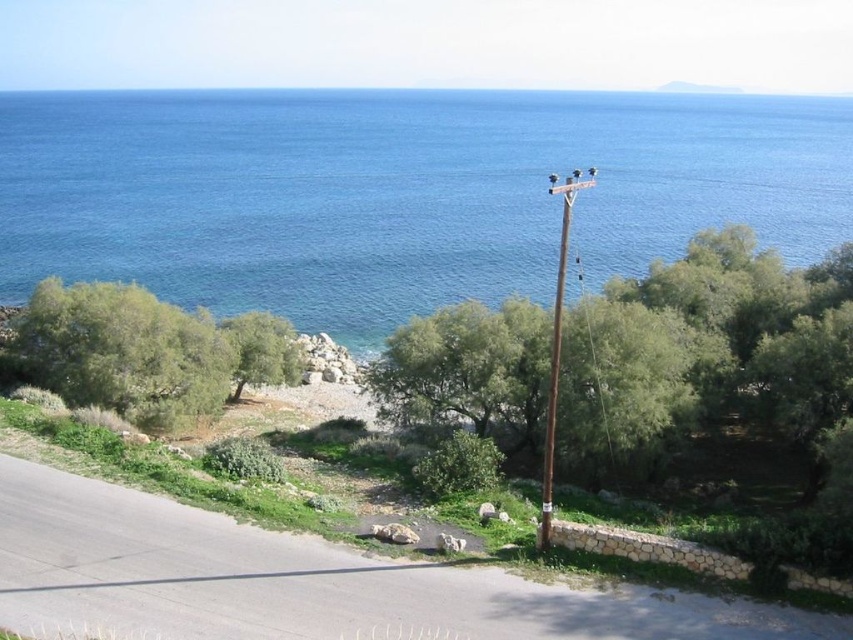
You are standing at the starting point of the road and want to reach the blue water at upper center. Which direction should you walk to get there?

The blue water at upper center is located at point (399, 193), so you should walk towards the upper center direction to reach it.

You are a hiker walking along the paved road in the coastal landscape. You see the blue water at upper center and the green leafy tree at center. Which object is located to the left of the other?

The blue water at upper center is positioned on the left side of green leafy tree at center.